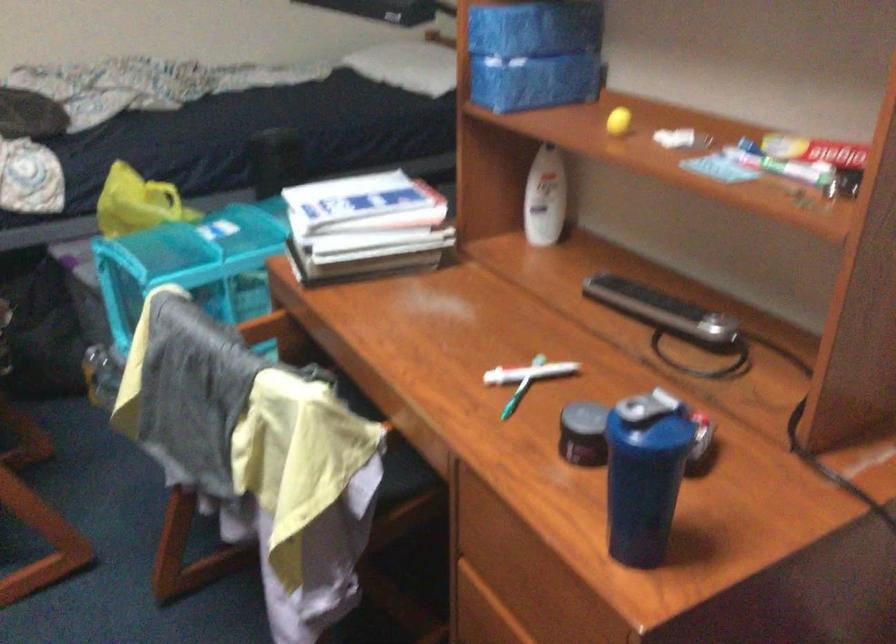
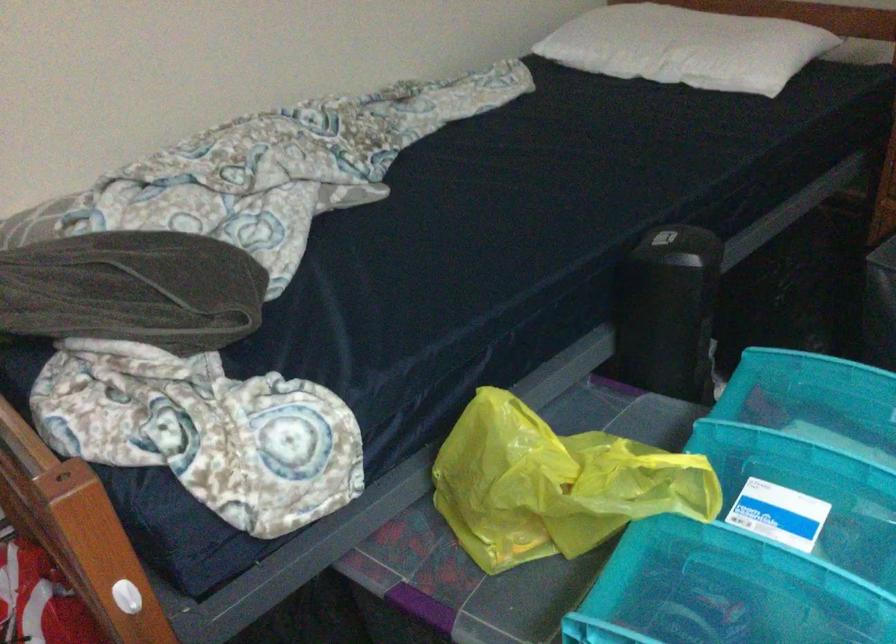
Which direction would the cameraman need to move to produce the second image?

The movement direction of the cameraman is left, forward.